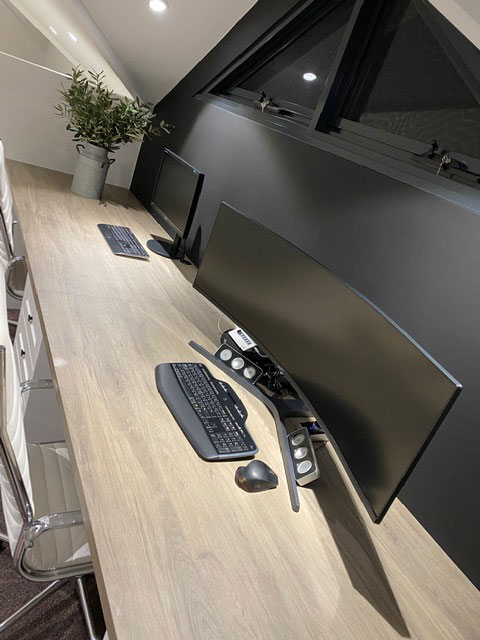
This screenshot has height=640, width=480. I want to click on white chair cushion, so click(x=59, y=484), click(x=16, y=433).